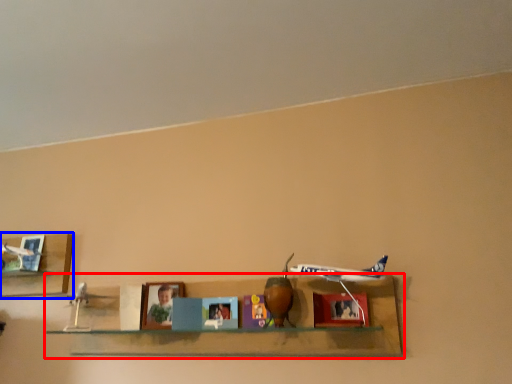
Question: Which object is closer to the camera taking this photo, shelf (highlighted by a red box) or shelf (highlighted by a blue box)?

Choices:
 (A) shelf
 (B) shelf

Answer: (A)